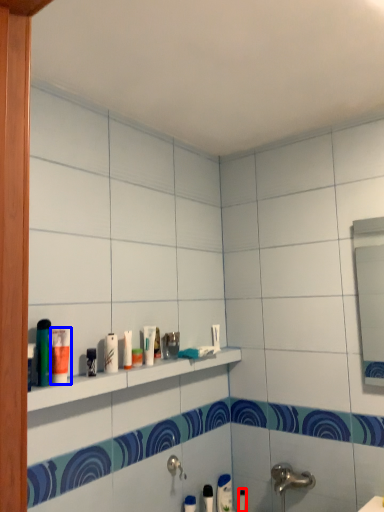
Question: Among these objects, which one is nearest to the camera, toiletry (highlighted by a red box) or toiletry (highlighted by a blue box)?

Choices:
 (A) toiletry
 (B) toiletry

Answer: (B)